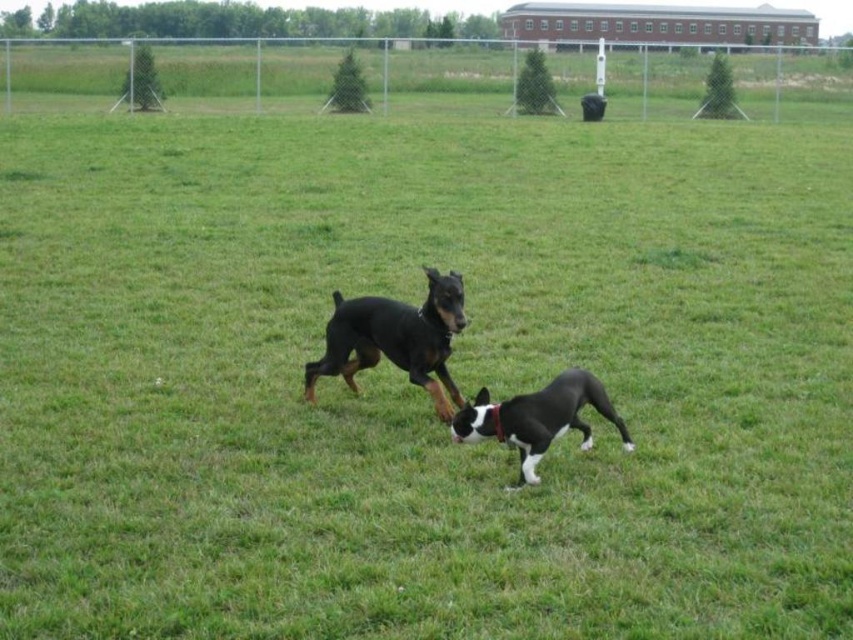
What animal is located at the coordinates point (395, 339) in the dog park scene?

The point (395, 339) marks the location of the black smooth doberman at center.

You are a dog owner who wants to ensure your dogs have enough space to play safely. You know that the recommended minimum distance between two dogs during play is 24 inches. Based on the scene, can you confirm if the black smooth doberman at center and the black matte dog at center are maintaining a safe distance?

The black smooth doberman at center and the black matte dog at center are 31.25 inches apart, which exceeds the recommended minimum distance of 24 inches. Therefore, they are maintaining a safe distance.